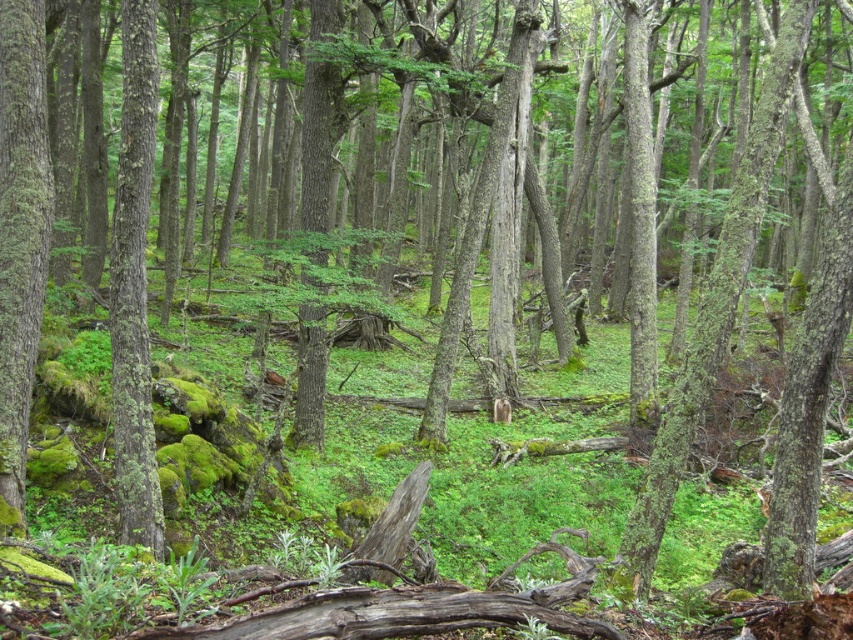
In the scene shown: Can you confirm if green mossy bark at left is shorter than green mossy bark tree trunk at left?

Correct, green mossy bark at left is not as tall as green mossy bark tree trunk at left.

Does point (19, 211) come in front of point (155, 96)?

Yes, point (19, 211) is closer to viewer.

The width and height of the screenshot is (853, 640). What do you see at coordinates (21, 228) in the screenshot?
I see `green mossy bark at left` at bounding box center [21, 228].

The image size is (853, 640). In order to click on green mossy bark at left in this screenshot , I will do `click(21, 228)`.